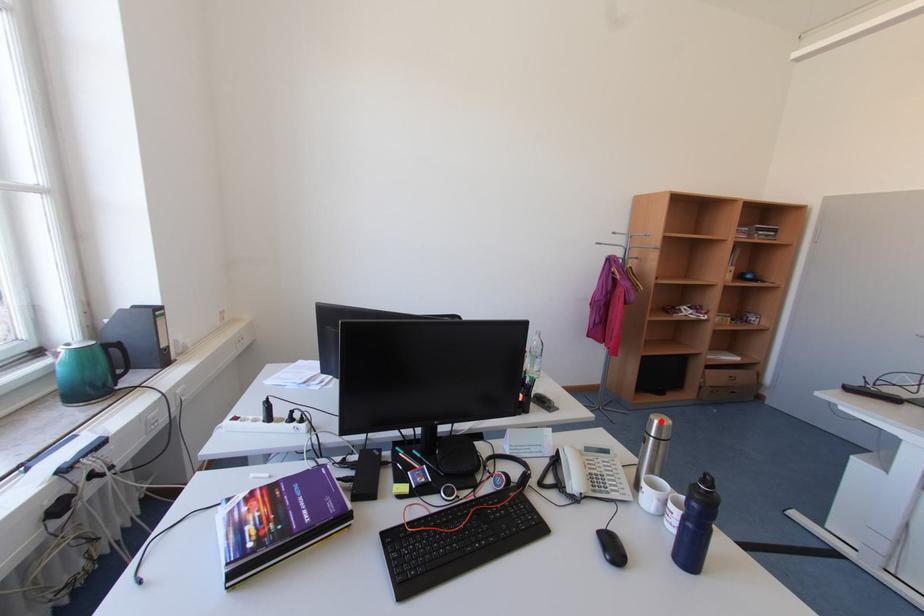
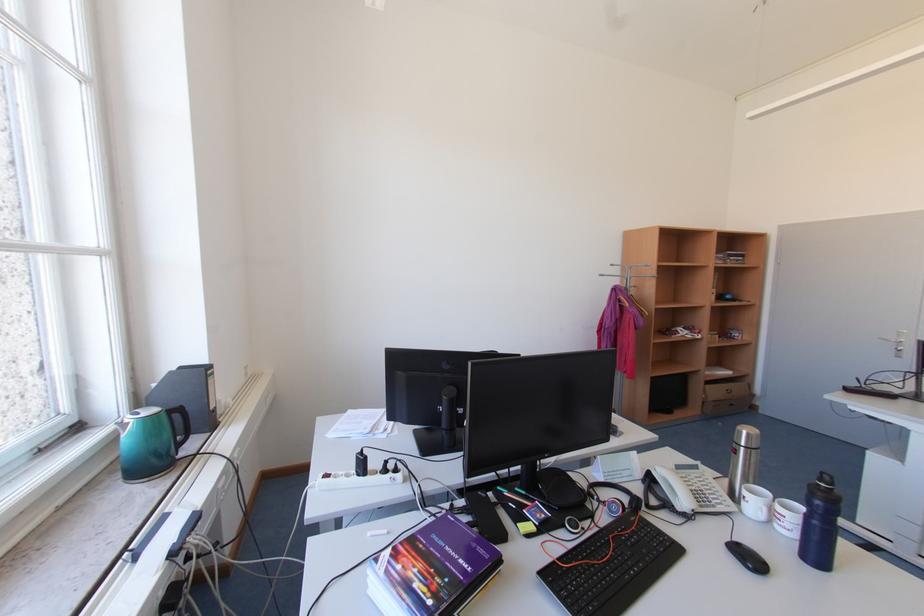
Locate, in the second image, the point that corresponds to the highlighted location in the first image.

(748, 432)